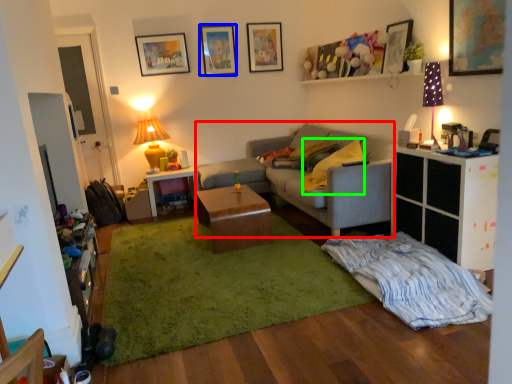
Question: Which is nearer to the studio couch (highlighted by a red box)? picture frame (highlighted by a blue box) or pillow (highlighted by a green box).

Choices:
 (A) picture frame
 (B) pillow

Answer: (B)